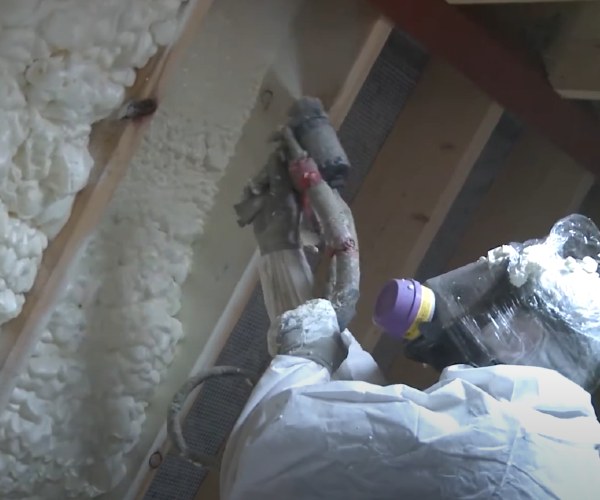
Locate an element on the screen. This screenshot has width=600, height=500. dark brown block of wood is located at coordinates (477, 66).